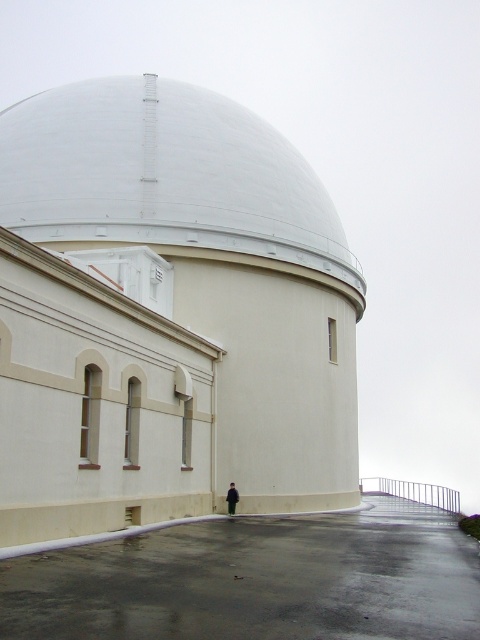
Question: Which point appears farthest from the camera in this image?

Choices:
 (A) (44, 188)
 (B) (229, 484)

Answer: (A)

Question: Which of the following is the farthest from the observer?

Choices:
 (A) (324, 188)
 (B) (236, 490)

Answer: (A)

Question: Which point is farther to the camera?

Choices:
 (A) (230, 499)
 (B) (83, 202)

Answer: (B)

Question: Considering the relative positions of white smooth dome at center and black matte jacket at lower center in the image provided, where is white smooth dome at center located with respect to black matte jacket at lower center?

Choices:
 (A) left
 (B) right

Answer: (A)

Question: Can you confirm if white smooth dome at center is positioned above black matte jacket at lower center?

Choices:
 (A) no
 (B) yes

Answer: (B)

Question: Is white smooth dome at center to the right of black matte jacket at lower center from the viewer's perspective?

Choices:
 (A) yes
 (B) no

Answer: (B)